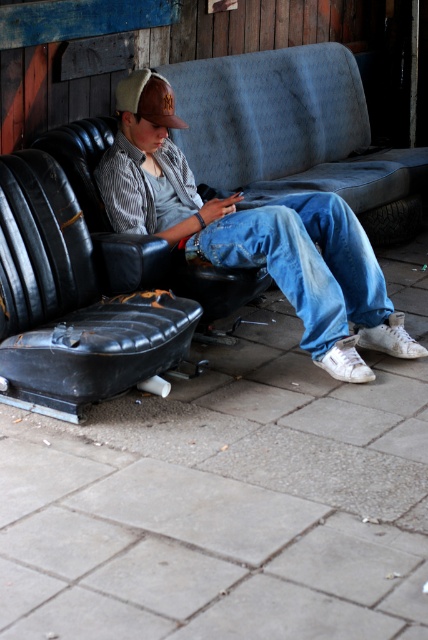
Question: Which object is the farthest from the brown leather baseball cap at upper center?

Choices:
 (A) gray concrete pavement at lower center
 (B) blue denim jeans at center
 (C) denim jeans at center
 (D) black rubber tire at lower right

Answer: (D)

Question: Considering the real-world distances, which object is closest to the gray concrete pavement at lower center?

Choices:
 (A) brown leather baseball cap at upper center
 (B) black rubber tire at lower right

Answer: (A)

Question: Does denim jeans at center appear over brown leather baseball cap at upper center?

Choices:
 (A) yes
 (B) no

Answer: (B)

Question: Among these objects, which one is farthest from the camera?

Choices:
 (A) blue denim jeans at center
 (B) brown leather baseball cap at upper center
 (C) denim jeans at center

Answer: (B)

Question: Does brown leather baseball cap at upper center appear on the right side of black rubber tire at lower right?

Choices:
 (A) yes
 (B) no

Answer: (B)

Question: Is black leather seat at left below black rubber tire at lower right?

Choices:
 (A) yes
 (B) no

Answer: (A)